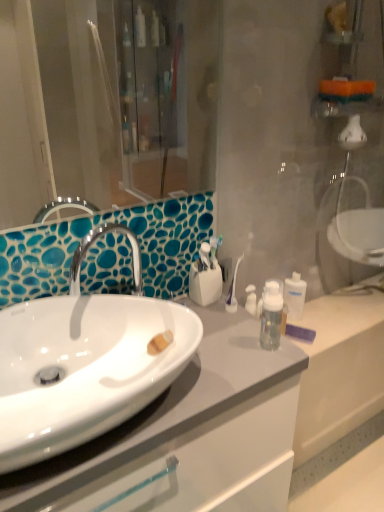
In order to click on spots to the right of clear plastic bottle at center-right in this screenshot , I will do `click(332, 314)`.